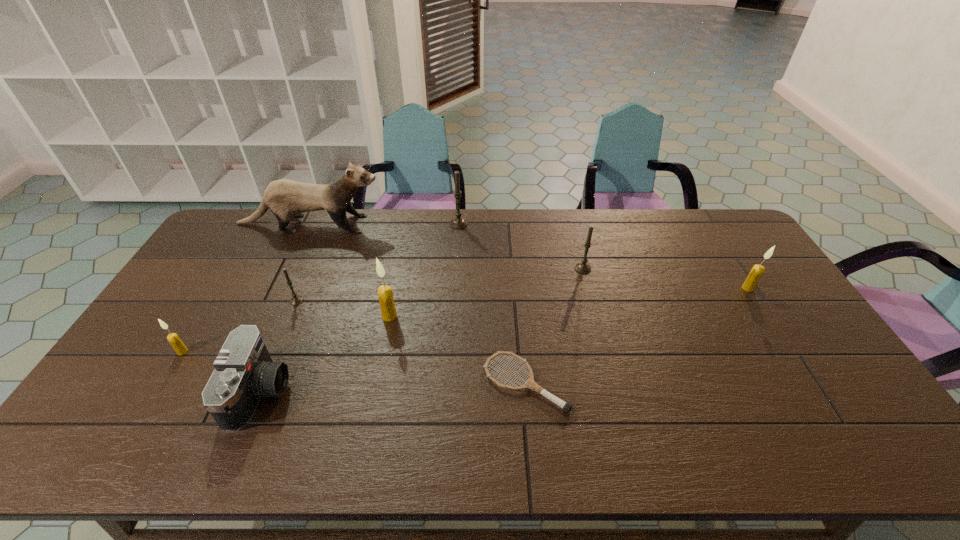
Image resolution: width=960 pixels, height=540 pixels. Find the location of `free space located on the back of the second smallest cream candle`. free space located on the back of the second smallest cream candle is located at coordinates (722, 247).

Locate an element on the screen. The width and height of the screenshot is (960, 540). free location located 0.130m on the left of the second candle from left to right is located at coordinates (248, 301).

Where is `vacant space located on the back of the leftmost candle`? The width and height of the screenshot is (960, 540). vacant space located on the back of the leftmost candle is located at coordinates (203, 319).

Image resolution: width=960 pixels, height=540 pixels. In order to click on free location located on the front-facing side of the black camera in this screenshot , I will do `click(349, 392)`.

This screenshot has width=960, height=540. In order to click on free region located 0.290m on the back of the tennis racket in this screenshot , I will do tap(516, 282).

The height and width of the screenshot is (540, 960). Identify the location of ferret at the far edge. (285, 198).

This screenshot has width=960, height=540. What are the coordinates of `candle at the far edge` in the screenshot? It's located at (458, 223).

This screenshot has width=960, height=540. I want to click on object that is positioned at the near edge, so click(244, 371).

Image resolution: width=960 pixels, height=540 pixels. What are the coordinates of `ferret present at the left edge` in the screenshot? It's located at (285, 198).

Find the location of `candle present at the left edge`. candle present at the left edge is located at coordinates (173, 338).